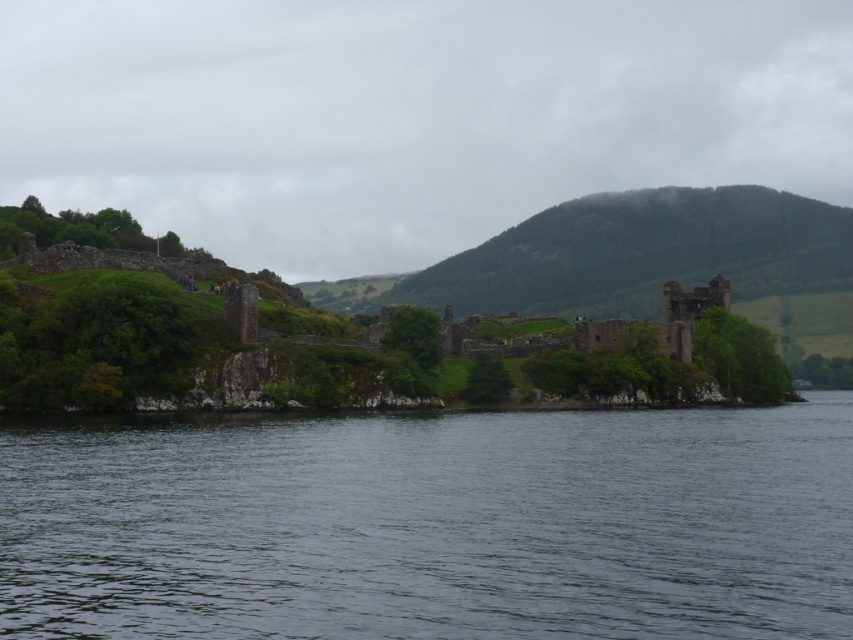
Which is above, transparent water at center or green grassy hill at center?

green grassy hill at center is higher up.

Does transparent water at center come in front of green grassy hill at center?

Yes, transparent water at center is in front of green grassy hill at center.

Is point (45, 568) closer to camera compared to point (614, 195)?

Yes, point (45, 568) is in front of point (614, 195).

Find the location of a particular element. The width and height of the screenshot is (853, 640). transparent water at center is located at coordinates (431, 524).

The image size is (853, 640). Describe the element at coordinates (643, 253) in the screenshot. I see `green grassy hill at center` at that location.

Is green grassy hill at center shorter than rusty stone castle at center?

No, green grassy hill at center is not shorter than rusty stone castle at center.

Between point (450, 264) and point (457, 344), which one is positioned behind?

The point (450, 264) is more distant.

You are a GUI agent. You are given a task and a screenshot of the screen. Output one action in this format:
    pyautogui.click(x=<x>, y=<y>)
    Task: Click on the green grassy hill at center
    Image resolution: width=853 pixels, height=640 pixels.
    Given the screenshot: What is the action you would take?
    pyautogui.click(x=643, y=253)

Is point (84, 513) positioned behind point (451, 340)?

No, it is not.

Between transparent water at center and rusty stone castle at center, which one appears on the right side from the viewer's perspective?

Positioned to the right is rusty stone castle at center.

This screenshot has height=640, width=853. Describe the element at coordinates (431, 524) in the screenshot. I see `transparent water at center` at that location.

Identify the location of transparent water at center. This screenshot has width=853, height=640. (431, 524).